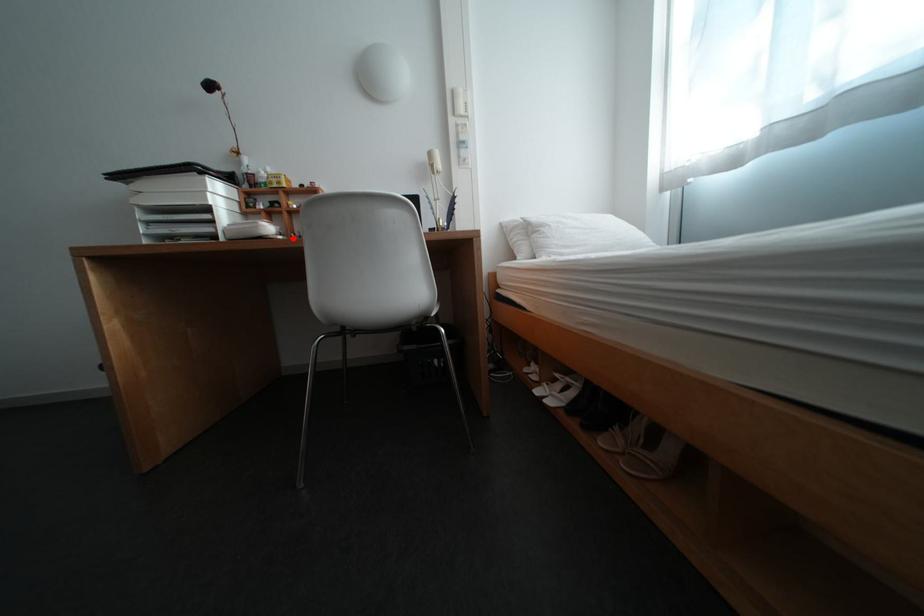
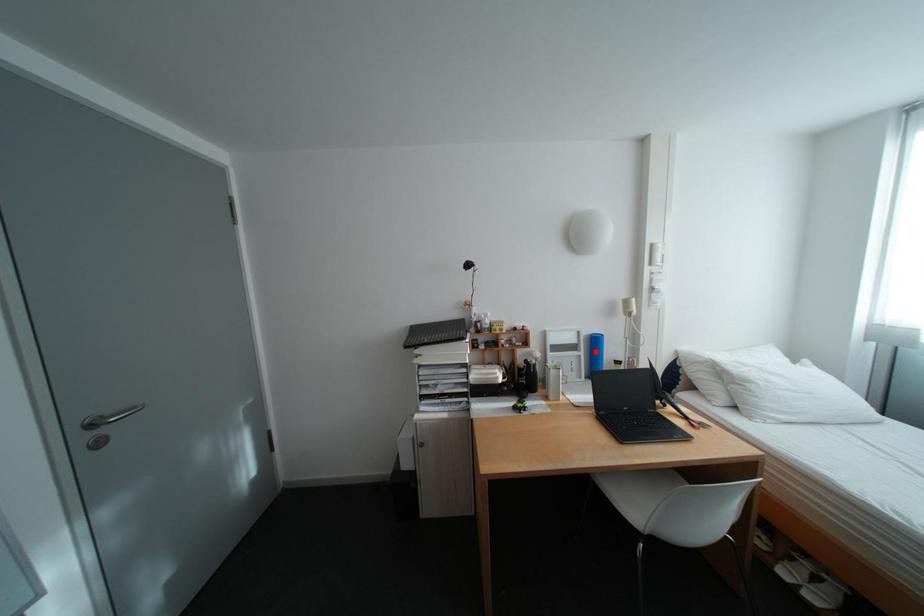
I am providing you with two images of the same scene from different viewpoints. A red point is marked on the first image and another point is marked on the second image. Does the point marked in image1 correspond to the same location as the one in image2?

No